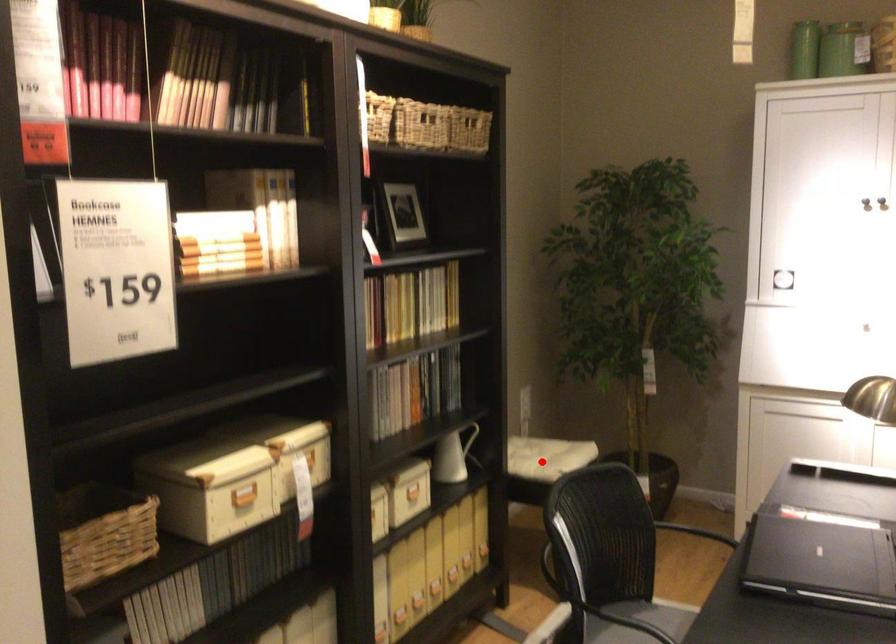
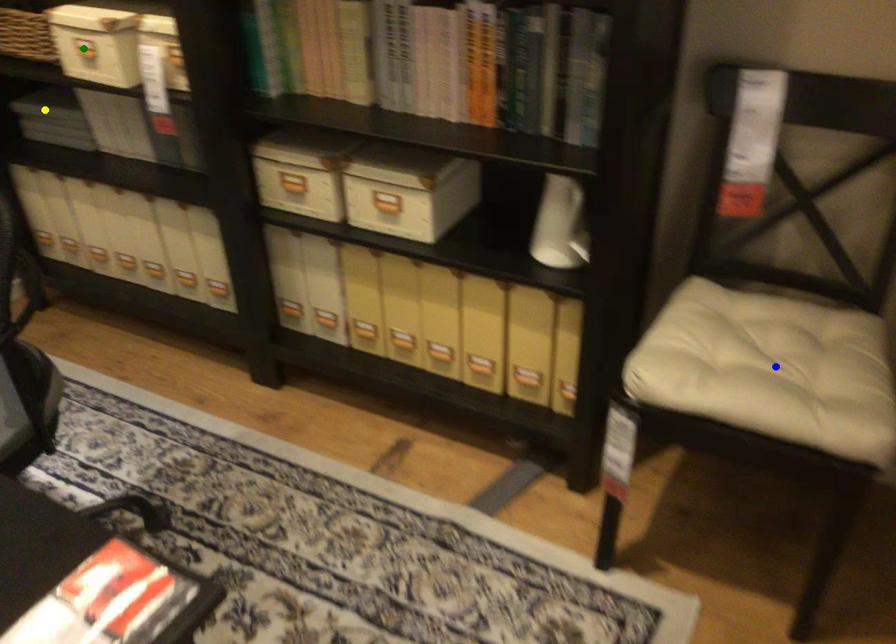
Question: I am providing you with two images of the same scene from different viewpoints. A red point is marked on the first image. You are given multiple points on the second image. Which point in image 2 is actually the same real-world point as the red point in image 1?

Choices:
 (A) green point
 (B) yellow point
 (C) blue point

Answer: (C)